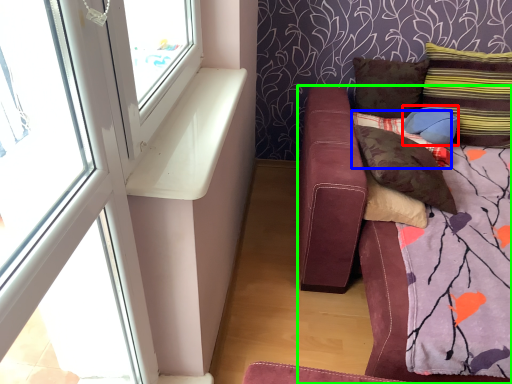
Question: Which is nearer to the pillow (highlighted by a red box)? pillow (highlighted by a blue box) or studio couch (highlighted by a green box).

Choices:
 (A) pillow
 (B) studio couch

Answer: (A)